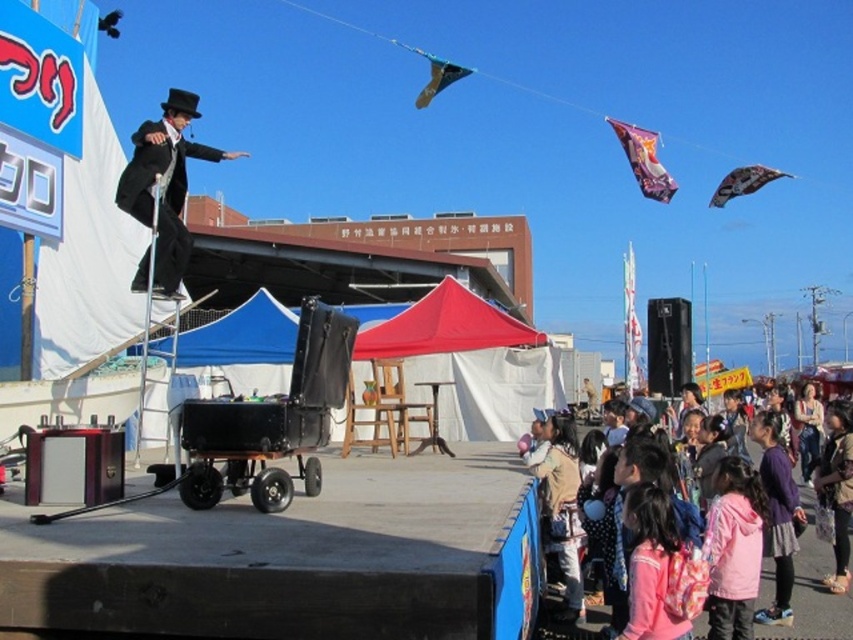
Is pink fabric crowd at lower right thinner than patterned fabric kite at upper right?

Yes, pink fabric crowd at lower right is thinner than patterned fabric kite at upper right.

Does pink fabric crowd at lower right appear on the right side of patterned fabric kite at upper right?

No, pink fabric crowd at lower right is not to the right of patterned fabric kite at upper right.

Where is `pink fabric crowd at lower right`? pink fabric crowd at lower right is located at coordinates (813, 589).

Where is `pink fabric crowd at lower right`? This screenshot has width=853, height=640. pink fabric crowd at lower right is located at coordinates [x=813, y=589].

Is shiny black suit at upper left positioned behind purple fabric kite at upper right?

No, it is not.

What do you see at coordinates (165, 182) in the screenshot?
I see `shiny black suit at upper left` at bounding box center [165, 182].

Is point (165, 289) positioned behind point (643, 172)?

That is False.

Image resolution: width=853 pixels, height=640 pixels. In order to click on shiny black suit at upper left in this screenshot , I will do `click(165, 182)`.

Which is more to the left, fluffy brown coat at lower right or patterned fabric kite at upper right?

Positioned to the left is fluffy brown coat at lower right.

Is fluffy brown coat at lower right smaller than patterned fabric kite at upper right?

Yes, fluffy brown coat at lower right is smaller than patterned fabric kite at upper right.

Locate an element on the screen. This screenshot has height=640, width=853. fluffy brown coat at lower right is located at coordinates (837, 486).